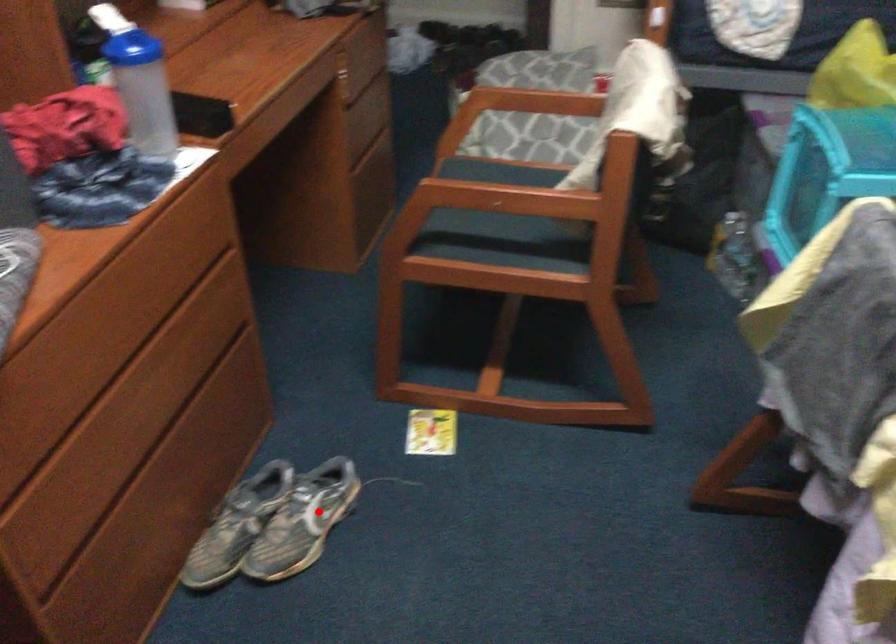
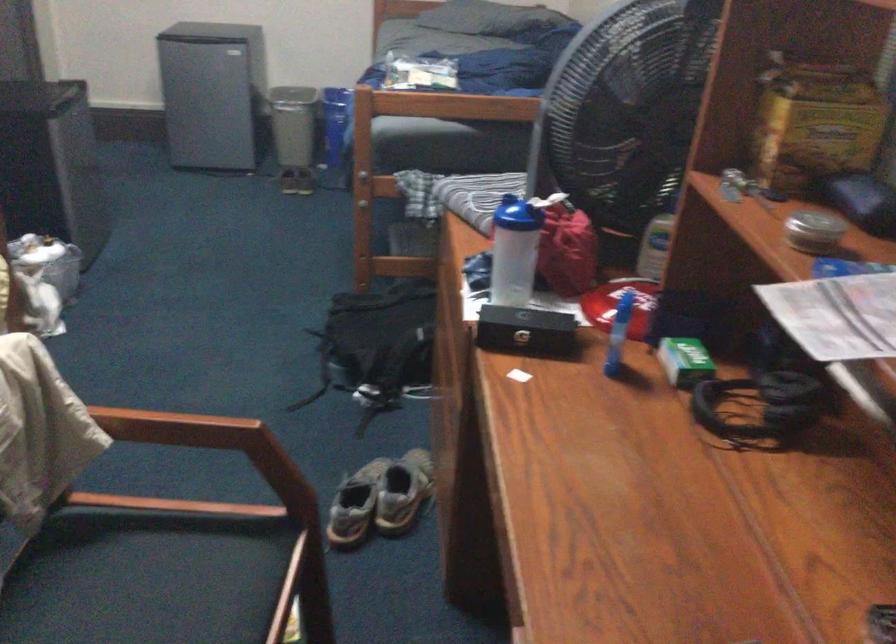
In the second image, find the point that corresponds to the highlighted location in the first image.

(355, 505)